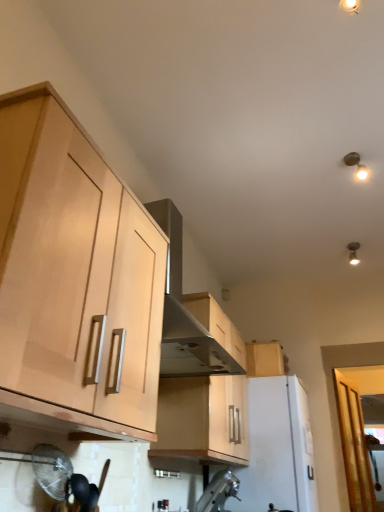
Question: Is stainless steel vent at upper center surrounding metallic ceiling light at upper right?

Choices:
 (A) no
 (B) yes

Answer: (A)

Question: Is the position of stainless steel vent at upper center more distant than that of metallic ceiling light at upper right?

Choices:
 (A) yes
 (B) no

Answer: (B)

Question: Does stainless steel vent at upper center appear on the right side of metallic ceiling light at upper right?

Choices:
 (A) yes
 (B) no

Answer: (B)

Question: From a real-world perspective, is stainless steel vent at upper center physically above metallic ceiling light at upper right?

Choices:
 (A) no
 (B) yes

Answer: (A)

Question: From the image's perspective, is stainless steel vent at upper center located beneath metallic ceiling light at upper right?

Choices:
 (A) yes
 (B) no

Answer: (A)

Question: From a real-world perspective, is stainless steel vent at upper center physically below metallic ceiling light at upper right?

Choices:
 (A) no
 (B) yes

Answer: (B)

Question: From a real-world perspective, is light wood cabinet at upper right, which appears as the first cabinetry when viewed from the back, positioned over stainless steel vent at upper center based on gravity?

Choices:
 (A) yes
 (B) no

Answer: (B)

Question: Is light wood cabinet at upper right, the third cabinetry in the left-to-right sequence, looking in the opposite direction of stainless steel vent at upper center?

Choices:
 (A) no
 (B) yes

Answer: (A)

Question: From the image's perspective, is light wood cabinet at upper right, the third cabinetry in the left-to-right sequence, above stainless steel vent at upper center?

Choices:
 (A) yes
 (B) no

Answer: (B)

Question: Can you confirm if light wood cabinet at upper right, the third cabinetry in the left-to-right sequence, is wider than stainless steel vent at upper center?

Choices:
 (A) no
 (B) yes

Answer: (A)

Question: Considering the relative sizes of light wood cabinet at upper right, which ranks as the 1th cabinetry in right-to-left order, and stainless steel vent at upper center in the image provided, is light wood cabinet at upper right, which ranks as the 1th cabinetry in right-to-left order, thinner than stainless steel vent at upper center?

Choices:
 (A) no
 (B) yes

Answer: (B)

Question: Can you confirm if light wood cabinet at upper right, which appears as the first cabinetry when viewed from the back, is positioned to the left of stainless steel vent at upper center?

Choices:
 (A) no
 (B) yes

Answer: (A)

Question: From the image's perspective, is light wood cabinet at left, the 1th cabinetry from the front, beneath stainless steel vent at upper center?

Choices:
 (A) yes
 (B) no

Answer: (A)